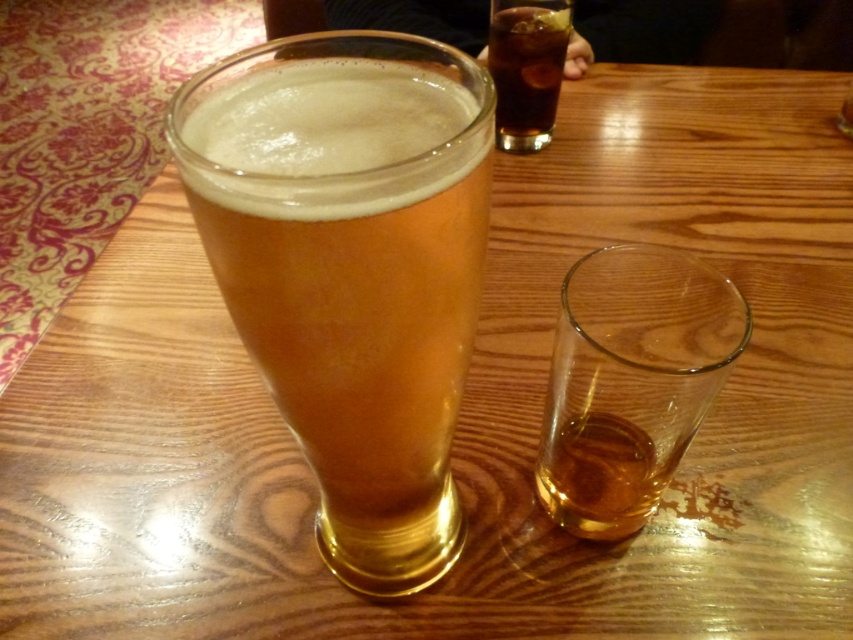
Question: Does translucent glass at lower right have a larger size compared to dark brown glass at upper center?

Choices:
 (A) no
 (B) yes

Answer: (B)

Question: Among these objects, which one is nearest to the camera?

Choices:
 (A) dark brown glass at upper center
 (B) golden glass at center
 (C) translucent glass at lower right

Answer: (B)

Question: Does golden glass at center appear on the right side of translucent glass at lower right?

Choices:
 (A) yes
 (B) no

Answer: (B)

Question: Observing the image, what is the correct spatial positioning of golden glass at center in reference to translucent glass at lower right?

Choices:
 (A) right
 (B) left

Answer: (B)

Question: Which object is farther from the camera taking this photo?

Choices:
 (A) golden glass at center
 (B) translucent glass at lower right

Answer: (B)

Question: Which point is closer to the camera?

Choices:
 (A) dark brown glass at upper center
 (B) golden glass at center

Answer: (B)